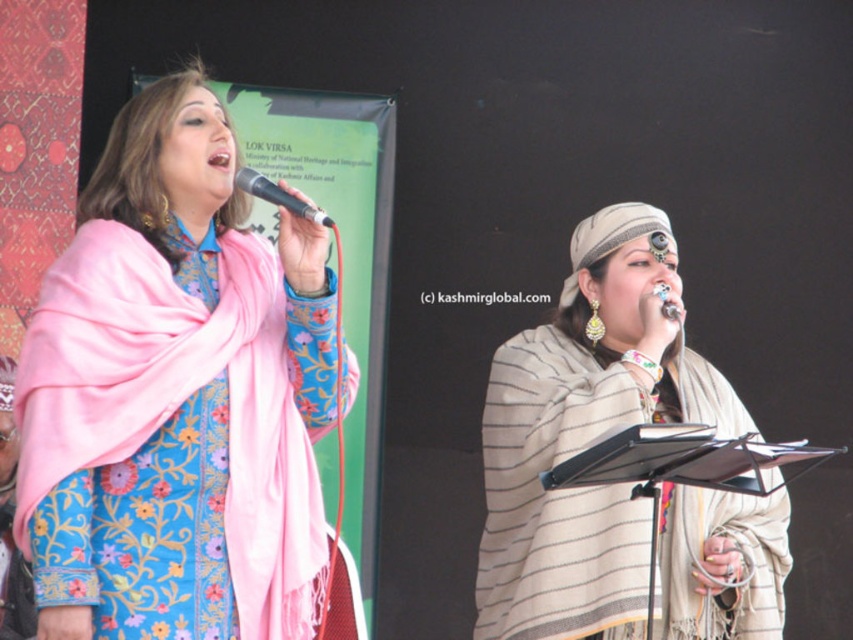
Question: Is matte pink scarf at left above metallic silver microphone at upper center?

Choices:
 (A) no
 (B) yes

Answer: (A)

Question: Which point is closer to the camera taking this photo?

Choices:
 (A) (248, 576)
 (B) (262, 196)

Answer: (B)

Question: Does matte pink scarf at left have a greater width compared to metallic silver microphone at upper center?

Choices:
 (A) no
 (B) yes

Answer: (B)

Question: Which object appears closest to the camera in this image?

Choices:
 (A) beige striped shawl at center
 (B) metallic silver microphone at upper center

Answer: (B)

Question: Which point is closer to the camera taking this photo?

Choices:
 (A) [x=288, y=200]
 (B) [x=764, y=579]
 (C) [x=219, y=536]

Answer: (A)

Question: Considering the relative positions of matte pink scarf at left and metallic silver microphone at upper center in the image provided, where is matte pink scarf at left located with respect to metallic silver microphone at upper center?

Choices:
 (A) left
 (B) right

Answer: (A)